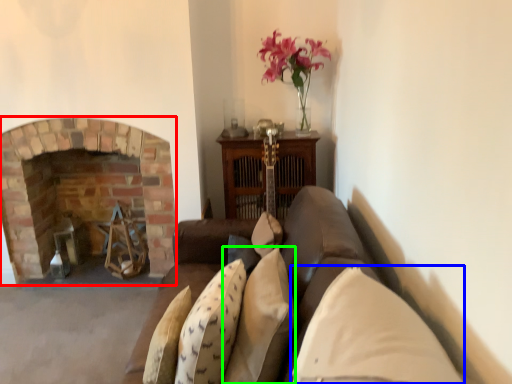
Question: Which is nearer to the fireplace (highlighted by a red box)? pillow (highlighted by a blue box) or pillow (highlighted by a green box).

Choices:
 (A) pillow
 (B) pillow

Answer: (B)